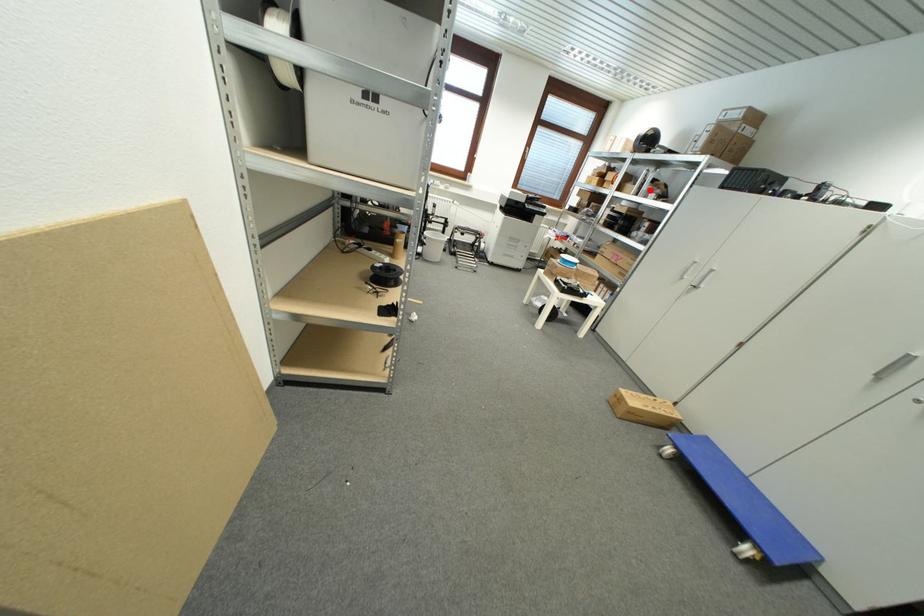
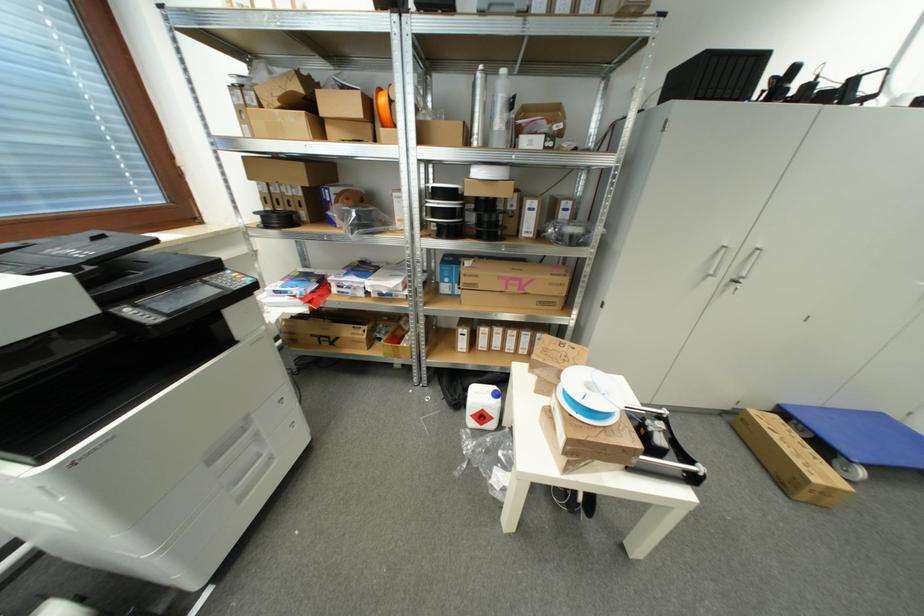
In the second image, find the point that corresponds to the highlighted location in the first image.

(504, 126)